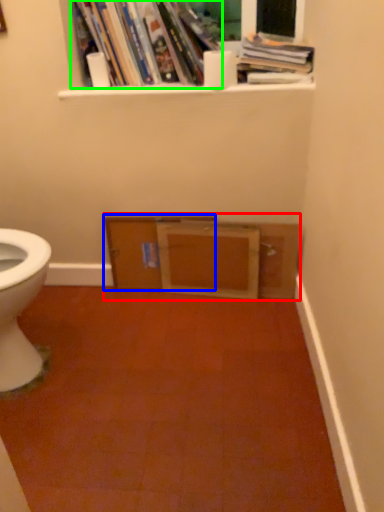
Question: Which object is positioned farthest from entertainment center (highlighted by a red box)? Select from file cabinet (highlighted by a blue box) and book (highlighted by a green box).

Choices:
 (A) file cabinet
 (B) book

Answer: (B)